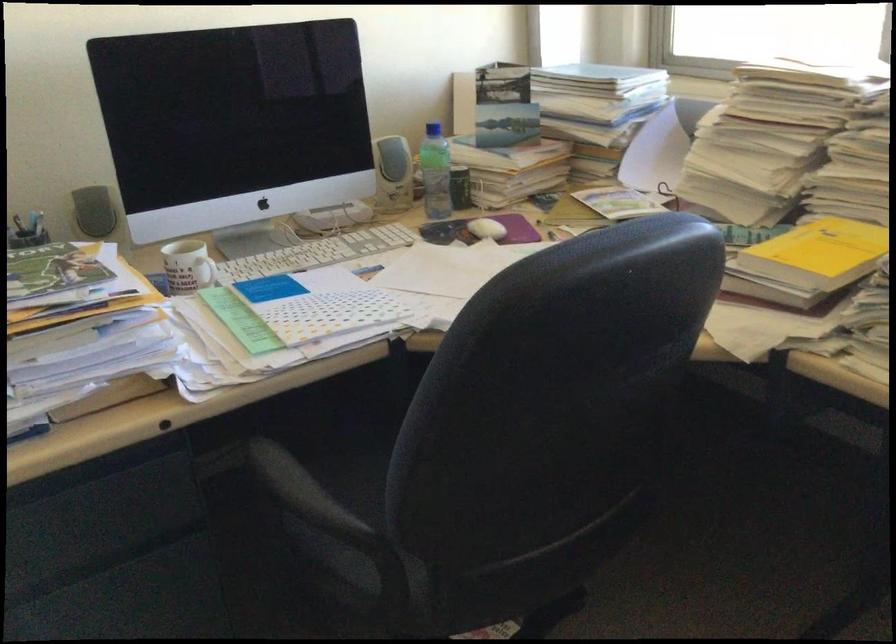
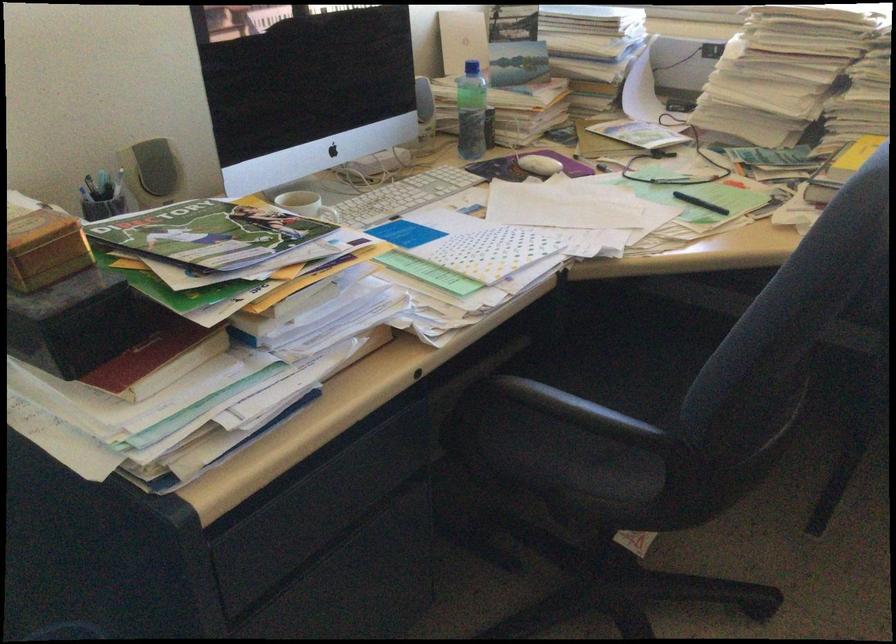
Question: I am providing you with two images of the same scene from different viewpoints. Please identify which objects are invisible in image2.

Choices:
 (A) white mug handle
 (B) black kettle handle
 (C) white cup handle
 (D) black drawer pull

Answer: (A)